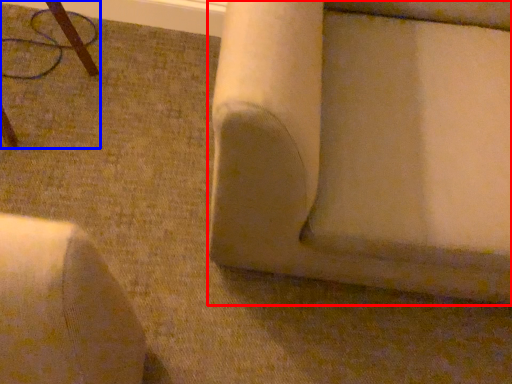
Question: Which point is further to the camera, furniture (highlighted by a red box) or furniture (highlighted by a blue box)?

Choices:
 (A) furniture
 (B) furniture

Answer: (B)